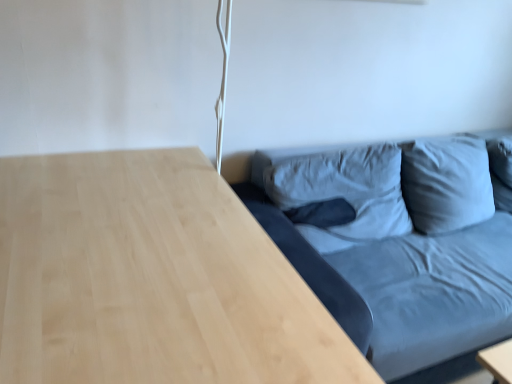
What do you see at coordinates (394, 264) in the screenshot?
I see `matte blue fabric couch at right` at bounding box center [394, 264].

This screenshot has width=512, height=384. Find the location of `matte blue fabric couch at right`. matte blue fabric couch at right is located at coordinates (394, 264).

Image resolution: width=512 pixels, height=384 pixels. Describe the element at coordinates (151, 279) in the screenshot. I see `light wood table at lower right` at that location.

This screenshot has height=384, width=512. What are the coordinates of `light wood table at lower right` in the screenshot? It's located at (151, 279).

What is the approximate width of light wood table at lower right?

It is 30.71 inches.

Locate an element on the screen. The image size is (512, 384). matte blue fabric couch at right is located at coordinates (394, 264).

Consider the image. Based on their positions, is matte blue fabric couch at right located to the left or right of light wood table at lower right?

Based on their positions, matte blue fabric couch at right is located to the right of light wood table at lower right.

Does matte blue fabric couch at right lie behind light wood table at lower right?

Yes, it is behind light wood table at lower right.

Is point (372, 281) closer to camera compared to point (91, 306)?

No, it is not.

From the image's perspective, is matte blue fabric couch at right above or below light wood table at lower right?

From the image's perspective, matte blue fabric couch at right appears above light wood table at lower right.

From a real-world perspective, is matte blue fabric couch at right on top of light wood table at lower right?

Correct, in the physical world, matte blue fabric couch at right is higher than light wood table at lower right.

In terms of width, does matte blue fabric couch at right look wider or thinner when compared to light wood table at lower right?

Considering their sizes, matte blue fabric couch at right looks broader than light wood table at lower right.

Between matte blue fabric couch at right and light wood table at lower right, which one has less height?

light wood table at lower right.

Considering the relative sizes of matte blue fabric couch at right and light wood table at lower right in the image provided, is matte blue fabric couch at right smaller than light wood table at lower right?

Actually, matte blue fabric couch at right might be larger than light wood table at lower right.

Does matte blue fabric couch at right contain light wood table at lower right?

No, light wood table at lower right is located outside of matte blue fabric couch at right.

Is matte blue fabric couch at right touching light wood table at lower right?

No, matte blue fabric couch at right is not next to light wood table at lower right.

Is matte blue fabric couch at right facing towards light wood table at lower right?

No, matte blue fabric couch at right is not facing towards light wood table at lower right.

In order to click on studio couch on the right of the light wood table at lower right in this screenshot , I will do `click(394, 264)`.

Between light wood table at lower right and matte blue fabric couch at right, which one appears on the left side from the viewer's perspective?

light wood table at lower right is more to the left.

Between light wood table at lower right and matte blue fabric couch at right, which one is positioned behind?

matte blue fabric couch at right is more distant.

Considering the positions of point (175, 150) and point (395, 196), is point (175, 150) closer or farther from the camera than point (395, 196)?

Point (175, 150) is closer to the camera than point (395, 196).

From the image's perspective, who appears lower, light wood table at lower right or matte blue fabric couch at right?

light wood table at lower right, from the image's perspective.

From a real-world perspective, between light wood table at lower right and matte blue fabric couch at right, who is vertically higher?

matte blue fabric couch at right is physically above.

Between light wood table at lower right and matte blue fabric couch at right, which one has larger width?

matte blue fabric couch at right.

Which of these two, light wood table at lower right or matte blue fabric couch at right, stands taller?

With more height is matte blue fabric couch at right.

Can you confirm if light wood table at lower right is smaller than matte blue fabric couch at right?

Correct, light wood table at lower right occupies less space than matte blue fabric couch at right.

Can we say light wood table at lower right lies outside matte blue fabric couch at right?

light wood table at lower right lies outside matte blue fabric couch at right's area.

Is light wood table at lower right not close to matte blue fabric couch at right?

No, light wood table at lower right is not far away from matte blue fabric couch at right.

Could you tell me if light wood table at lower right is turned towards matte blue fabric couch at right?

Yes, light wood table at lower right faces towards matte blue fabric couch at right.

This screenshot has width=512, height=384. I want to click on table in front of the matte blue fabric couch at right, so click(x=151, y=279).

The image size is (512, 384). What are the coordinates of `table lying on the left of matte blue fabric couch at right` in the screenshot? It's located at (151, 279).

This screenshot has height=384, width=512. Find the location of `studio couch located above the light wood table at lower right (from the image's perspective)`. studio couch located above the light wood table at lower right (from the image's perspective) is located at coordinates (394, 264).